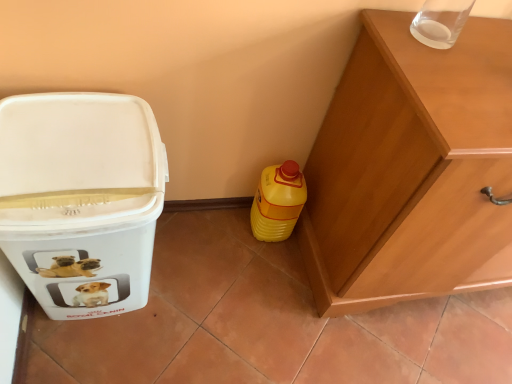
Identify the location of free space between wooden cabinet at right and white plastic container at left. Image resolution: width=512 pixels, height=384 pixels. (228, 274).